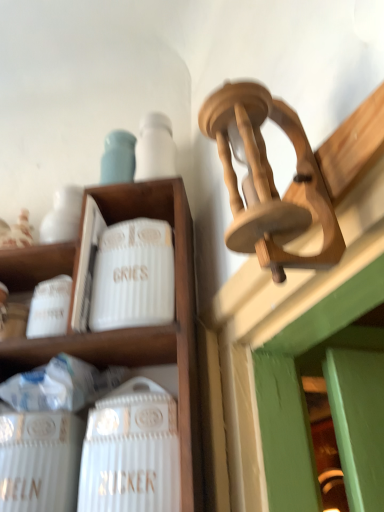
Question: Is white ceramic canister at upper left facing away from white ceramic wine bottle at lower left?

Choices:
 (A) no
 (B) yes

Answer: (B)

Question: Does white ceramic canister at upper left lie behind white ceramic wine bottle at lower left?

Choices:
 (A) yes
 (B) no

Answer: (A)

Question: Can you confirm if white ceramic canister at upper left is positioned to the right of white ceramic wine bottle at lower left?

Choices:
 (A) yes
 (B) no

Answer: (B)

Question: Is white ceramic canister at upper left outside white ceramic wine bottle at lower left?

Choices:
 (A) no
 (B) yes

Answer: (B)

Question: Is white ceramic canister at upper left next to white ceramic wine bottle at lower left?

Choices:
 (A) yes
 (B) no

Answer: (B)

Question: From the image's perspective, is white ceramic canister at upper left above white ceramic wine bottle at lower left?

Choices:
 (A) no
 (B) yes

Answer: (B)

Question: Could you tell me if white ribbed ceramic canister at center-left is facing white ceramic canister at upper left?

Choices:
 (A) no
 (B) yes

Answer: (B)

Question: From the image's perspective, is white ribbed ceramic canister at center-left located above white ceramic canister at upper left?

Choices:
 (A) yes
 (B) no

Answer: (A)

Question: Does white ribbed ceramic canister at center-left lie in front of white ceramic canister at upper left?

Choices:
 (A) yes
 (B) no

Answer: (B)

Question: From a real-world perspective, does white ribbed ceramic canister at center-left sit lower than white ceramic canister at upper left?

Choices:
 (A) yes
 (B) no

Answer: (B)

Question: From a real-world perspective, is white ribbed ceramic canister at center-left over white ceramic canister at upper left?

Choices:
 (A) yes
 (B) no

Answer: (A)

Question: Is white ribbed ceramic canister at center-left not near white ceramic canister at upper left?

Choices:
 (A) no
 (B) yes

Answer: (A)

Question: Does white ribbed ceramic canister at center-left have a lesser height compared to white ceramic wine bottle at lower left?

Choices:
 (A) yes
 (B) no

Answer: (A)